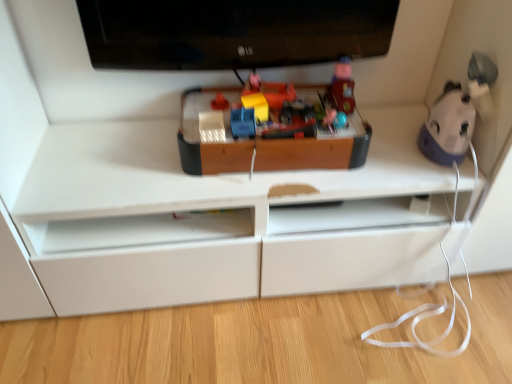
Image resolution: width=512 pixels, height=384 pixels. I want to click on vacant area that is situated to the right of yellow plastic toy at center, the fourth toy from the right, so click(309, 110).